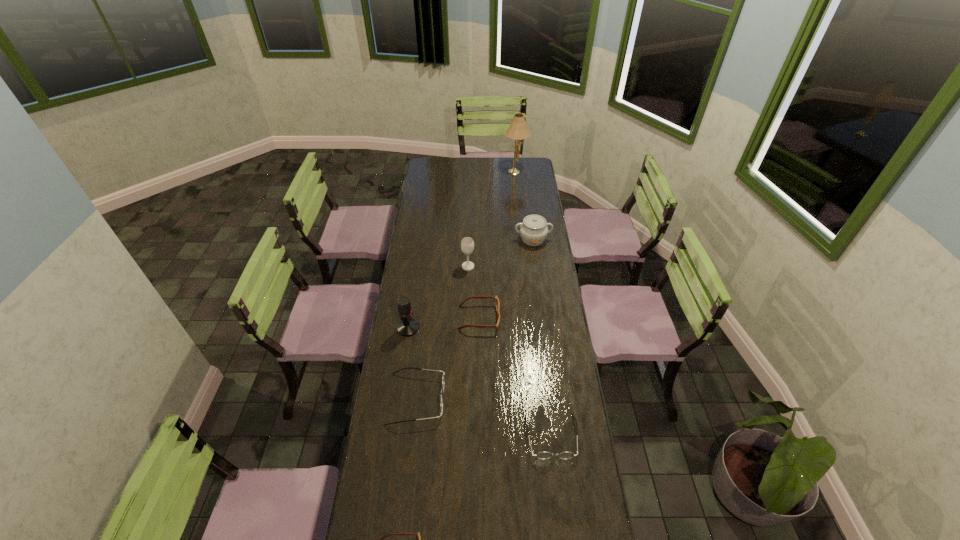
Find the location of a particular element. spectacles that is the closest to the farthest object is located at coordinates (497, 304).

Select which spectacles appears as the closest to the chinaware. Please provide its 2D coordinates. Your answer should be formatted as a tuple, i.e. [(x, y)], where the tuple contains the x and y coordinates of a point satisfying the conditions above.

[(497, 304)]

Locate which dark spectacles is the closest to the right brown spectacles. Please provide its 2D coordinates. Your answer should be formatted as a tuple, i.e. [(x, y)], where the tuple contains the x and y coordinates of a point satisfying the conditions above.

[(441, 396)]